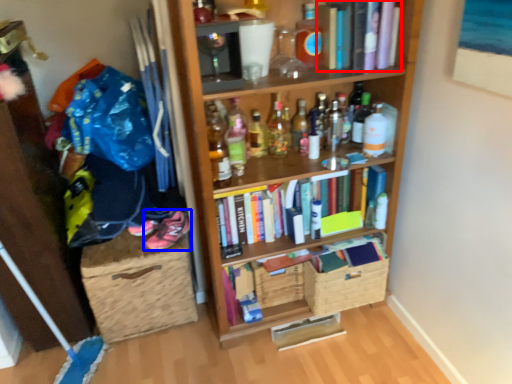
Question: Which object is further to the camera taking this photo, book (highlighted by a red box) or footwear (highlighted by a blue box)?

Choices:
 (A) book
 (B) footwear

Answer: (B)